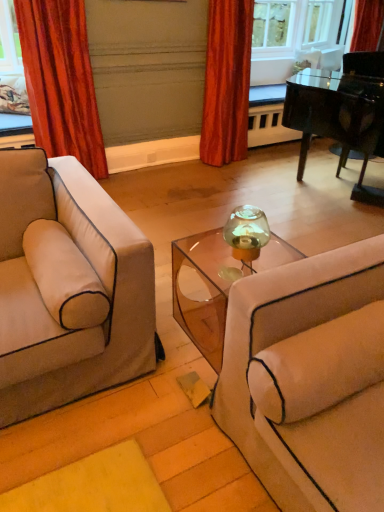
Where is `velvet orange curtain at left, marked as the second curtain in a right-to-left arrangement`? The width and height of the screenshot is (384, 512). velvet orange curtain at left, marked as the second curtain in a right-to-left arrangement is located at coordinates (61, 81).

Identify the location of transparent acrylic table at center. (214, 285).

Describe the element at coordinates (364, 64) in the screenshot. I see `shiny black piano at upper right` at that location.

Locate an element on the screen. This screenshot has width=384, height=512. velvet orange curtain at left, placed as the 1th curtain when sorted from left to right is located at coordinates (61, 81).

Which object is wider, shiny black piano at upper right or beige fabric pillow at right?

shiny black piano at upper right.

From a real-world perspective, who is located higher, shiny black piano at upper right or beige fabric pillow at right?

shiny black piano at upper right is physically above.

How distant is shiny black piano at upper right from beige fabric pillow at right?

shiny black piano at upper right and beige fabric pillow at right are 7.99 feet apart from each other.

Find the location of a particular element. Image resolution: width=384 pixels, height=512 pixels. armchair above the beige fabric pillow at right (from a real-world perspective) is located at coordinates (364, 64).

From a real-world perspective, is velvet orange curtain at left, placed as the 1th curtain when sorted from left to right, physically located above or below beige fabric pillow at right?

Clearly, from a real-world perspective, velvet orange curtain at left, placed as the 1th curtain when sorted from left to right, is above beige fabric pillow at right.

Can you tell me how much velvet orange curtain at left, marked as the second curtain in a right-to-left arrangement, and beige fabric pillow at right differ in facing direction?

The angular difference between velvet orange curtain at left, marked as the second curtain in a right-to-left arrangement, and beige fabric pillow at right is 1.07 degrees.

From the image's perspective, is velvet orange curtain at left, marked as the second curtain in a right-to-left arrangement, positioned above or below beige fabric pillow at right?

Clearly, from the image's perspective, velvet orange curtain at left, marked as the second curtain in a right-to-left arrangement, is above beige fabric pillow at right.

Could you measure the distance between velvet orange curtain at left, marked as the second curtain in a right-to-left arrangement, and beige fabric pillow at right?

velvet orange curtain at left, marked as the second curtain in a right-to-left arrangement, and beige fabric pillow at right are 2.64 meters apart from each other.

Where is `curtain that is the 2nd object above the transparent acrylic table at center (from a real-world perspective)`? This screenshot has height=512, width=384. curtain that is the 2nd object above the transparent acrylic table at center (from a real-world perspective) is located at coordinates (227, 82).

Is transparent acrylic table at center oriented away from velvet red curtain at upper center, the first curtain when ordered from right to left?

That's not correct — transparent acrylic table at center is not looking away from velvet red curtain at upper center, the first curtain when ordered from right to left.

Is point (239, 267) positioned in front of point (219, 15)?

Yes.

From a real-world perspective, is beige fabric pillow at right on top of velvet orange curtain at left, marked as the second curtain in a right-to-left arrangement?

No.

From the image's perspective, who appears lower, beige fabric pillow at right or velvet orange curtain at left, marked as the second curtain in a right-to-left arrangement?

beige fabric pillow at right, from the image's perspective.

Considering the positions of objects beige fabric pillow at right and velvet orange curtain at left, placed as the 1th curtain when sorted from left to right, in the image provided, who is in front, beige fabric pillow at right or velvet orange curtain at left, placed as the 1th curtain when sorted from left to right,?

beige fabric pillow at right.

Considering the sizes of objects shiny black piano at upper right and velvet orange curtain at left, marked as the second curtain in a right-to-left arrangement, in the image provided, who is taller, shiny black piano at upper right or velvet orange curtain at left, marked as the second curtain in a right-to-left arrangement,?

shiny black piano at upper right is taller.

Which is behind, point (374, 70) or point (54, 120)?

Positioned behind is point (54, 120).

From the image's perspective, between shiny black piano at upper right and velvet orange curtain at left, placed as the 1th curtain when sorted from left to right, which one is located above?

From the image's view, shiny black piano at upper right is above.

Which object is thinner, shiny black piano at upper right or velvet orange curtain at left, placed as the 1th curtain when sorted from left to right?

velvet orange curtain at left, placed as the 1th curtain when sorted from left to right.

What's the angular difference between shiny black piano at upper right and transparent acrylic table at center's facing directions?

0.387 degrees separate the facing orientations of shiny black piano at upper right and transparent acrylic table at center.

From a real-world perspective, is shiny black piano at upper right positioned above or below transparent acrylic table at center?

From a real-world perspective, shiny black piano at upper right is physically above transparent acrylic table at center.

How far apart are shiny black piano at upper right and transparent acrylic table at center?

1.91 meters.

Find the location of a particular element. The width and height of the screenshot is (384, 512). armchair on the right of the transparent acrylic table at center is located at coordinates (364, 64).

From the image's perspective, is velvet orange curtain at left, placed as the 1th curtain when sorted from left to right, above transparent acrylic table at center?

Indeed, from the image's perspective, velvet orange curtain at left, placed as the 1th curtain when sorted from left to right, is shown above transparent acrylic table at center.

Which of these two, velvet orange curtain at left, marked as the second curtain in a right-to-left arrangement, or transparent acrylic table at center, stands shorter?

With less height is transparent acrylic table at center.

Can you confirm if velvet orange curtain at left, marked as the second curtain in a right-to-left arrangement, is smaller than transparent acrylic table at center?

Incorrect, velvet orange curtain at left, marked as the second curtain in a right-to-left arrangement, is not smaller in size than transparent acrylic table at center.

The width and height of the screenshot is (384, 512). Identify the location of table on the right of velvet orange curtain at left, placed as the 1th curtain when sorted from left to right. (214, 285).

What are the coordinates of `pillow below the shiny black piano at upper right (from the image's perspective)` in the screenshot? It's located at (319, 366).

I want to click on pillow in front of the velvet orange curtain at left, marked as the second curtain in a right-to-left arrangement, so click(319, 366).

Estimate the real-world distances between objects in this image. Which object is further from beige fabric pillow at right, transparent acrylic table at center or velvet red curtain at upper center, the second curtain when ordered from left to right?

The object further to beige fabric pillow at right is velvet red curtain at upper center, the second curtain when ordered from left to right.

From the image, which object appears to be nearer to velvet orange curtain at left, marked as the second curtain in a right-to-left arrangement, beige fabric pillow at right or velvet red curtain at upper center, the second curtain when ordered from left to right?

Based on the image, velvet red curtain at upper center, the second curtain when ordered from left to right, appears to be nearer to velvet orange curtain at left, marked as the second curtain in a right-to-left arrangement.

Estimate the real-world distances between objects in this image. Which object is closer to velvet red curtain at upper center, the second curtain when ordered from left to right, shiny black piano at upper right or beige fabric pillow at right?

shiny black piano at upper right is closer to velvet red curtain at upper center, the second curtain when ordered from left to right.

Consider the image. Looking at the image, which one is located closer to velvet orange curtain at left, placed as the 1th curtain when sorted from left to right, velvet red curtain at upper center, the first curtain when ordered from right to left, or shiny black piano at upper right?

velvet red curtain at upper center, the first curtain when ordered from right to left, lies closer to velvet orange curtain at left, placed as the 1th curtain when sorted from left to right, than the other object.

Looking at the image, which one is located further to beige fabric pillow at right, velvet orange curtain at left, marked as the second curtain in a right-to-left arrangement, or transparent acrylic table at center?

velvet orange curtain at left, marked as the second curtain in a right-to-left arrangement, lies further to beige fabric pillow at right than the other object.

From the picture: Estimate the real-world distances between objects in this image. Which object is closer to velvet red curtain at upper center, the first curtain when ordered from right to left, transparent acrylic table at center or velvet orange curtain at left, marked as the second curtain in a right-to-left arrangement?

velvet orange curtain at left, marked as the second curtain in a right-to-left arrangement, is closer to velvet red curtain at upper center, the first curtain when ordered from right to left.

From the image, which object appears to be nearer to shiny black piano at upper right, velvet orange curtain at left, marked as the second curtain in a right-to-left arrangement, or transparent acrylic table at center?

transparent acrylic table at center lies closer to shiny black piano at upper right than the other object.

When comparing their distances from beige fabric pillow at right, does velvet orange curtain at left, placed as the 1th curtain when sorted from left to right, or velvet red curtain at upper center, the first curtain when ordered from right to left, seem closer?

velvet orange curtain at left, placed as the 1th curtain when sorted from left to right.

Find the location of a particular element. pillow situated between velvet orange curtain at left, placed as the 1th curtain when sorted from left to right, and shiny black piano at upper right from left to right is located at coordinates (319, 366).

You are a GUI agent. You are given a task and a screenshot of the screen. Output one action in this format:
    pyautogui.click(x=<x>, y=<y>)
    Task: Click on the table between velvet orange curtain at left, placed as the 1th curtain when sorted from left to right, and beige fabric pillow at right in the up-down direction
    The height and width of the screenshot is (512, 384).
    Given the screenshot: What is the action you would take?
    pyautogui.click(x=214, y=285)

This screenshot has width=384, height=512. I want to click on curtain between velvet orange curtain at left, marked as the second curtain in a right-to-left arrangement, and shiny black piano at upper right, in the horizontal direction, so click(x=227, y=82).

Where is `table between velvet orange curtain at left, marked as the second curtain in a right-to-left arrangement, and shiny black piano at upper right from left to right`? Image resolution: width=384 pixels, height=512 pixels. table between velvet orange curtain at left, marked as the second curtain in a right-to-left arrangement, and shiny black piano at upper right from left to right is located at coordinates (214, 285).